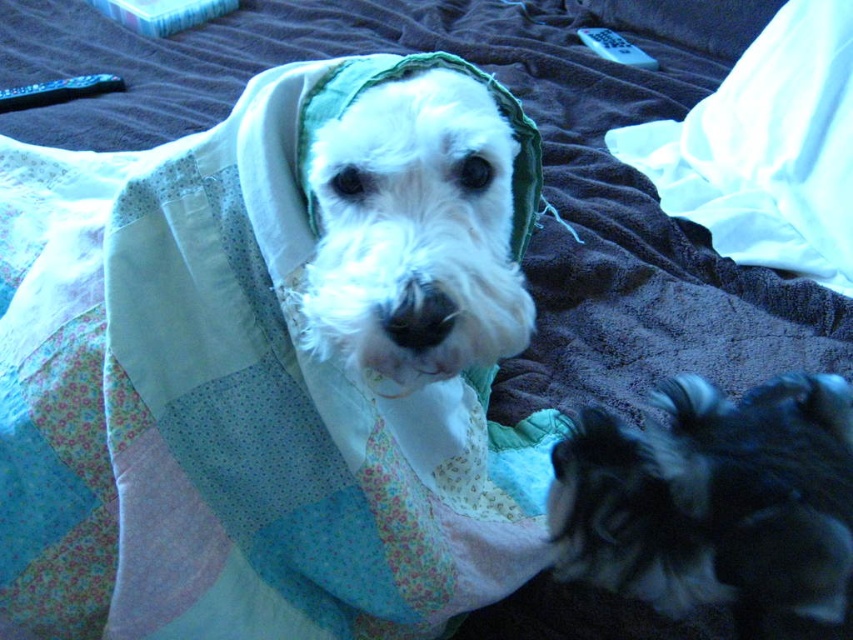
Does white fluffy dog at center appear on the right side of white satin pillow at upper right?

No, white fluffy dog at center is not to the right of white satin pillow at upper right.

Which of these two, white fluffy dog at center or white satin pillow at upper right, stands taller?

With more height is white satin pillow at upper right.

Which is in front, point (347, 252) or point (809, 76)?

Point (347, 252) is more forward.

This screenshot has height=640, width=853. Find the location of `white fluffy dog at center`. white fluffy dog at center is located at coordinates (421, 224).

Does black fluffy dog at lower right appear over white satin pillow at upper right?

Incorrect, black fluffy dog at lower right is not positioned above white satin pillow at upper right.

Is black fluffy dog at lower right to the right of white satin pillow at upper right from the viewer's perspective?

No, black fluffy dog at lower right is not to the right of white satin pillow at upper right.

Is point (589, 492) farther from camera compared to point (689, 163)?

No, it is not.

The image size is (853, 640). I want to click on black fluffy dog at lower right, so click(x=717, y=504).

Is black fluffy dog at lower right wider than white fluffy dog at center?

Indeed, black fluffy dog at lower right has a greater width compared to white fluffy dog at center.

Does black fluffy dog at lower right have a greater height compared to white fluffy dog at center?

In fact, black fluffy dog at lower right may be shorter than white fluffy dog at center.

Find the location of a particular element. This screenshot has height=640, width=853. black fluffy dog at lower right is located at coordinates (717, 504).